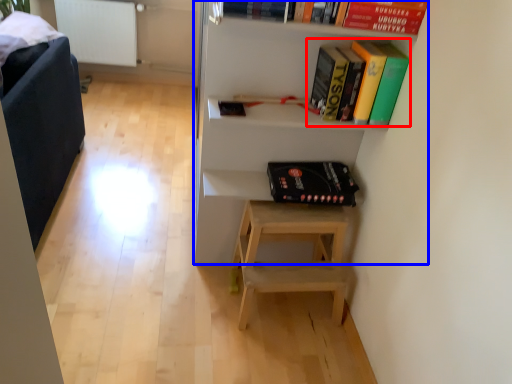
Question: Among these objects, which one is nearest to the camera, book (highlighted by a red box) or shelf (highlighted by a blue box)?

Choices:
 (A) book
 (B) shelf

Answer: (B)